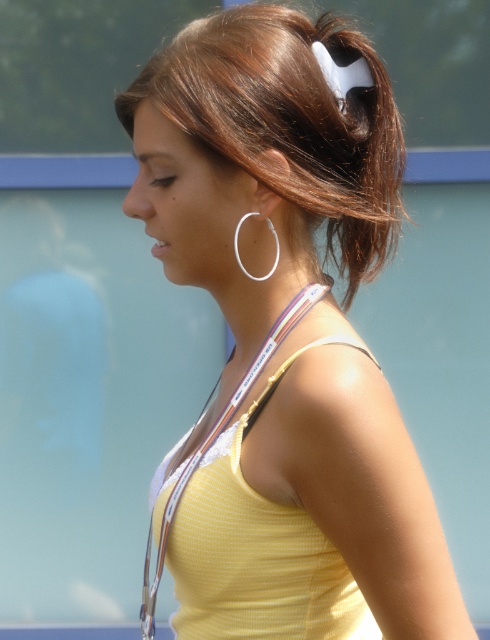
You are taking a photo of the woman and notice two points marked in the image. The first point is at coordinates point (346,182) and the second is at point (273,234). Which point is closer to the camera?

Point (346,182) is further to the camera than point (273,234), so the second point is closer to the camera.

You are a photographer taking a portrait of the woman. You need to ensure that both the brown shiny hair at upper center and the silver metallic hoop at upper center are clearly visible in the frame. Given their sizes, which object should you focus on to ensure both are in focus?

The brown shiny hair at upper center has a larger size compared to the silver metallic hoop at upper center. To ensure both are in focus, you should focus on the brown shiny hair at upper center since it is larger and will require more precise focus to capture details, while the smaller silver metallic hoop at upper center will naturally be within the depth of field.

You are a photographer taking a portrait of the woman. You notice the brown shiny hair at upper center and the silver metallic hoop at upper center. Which object is closer to the camera?

The brown shiny hair at upper center is closer to the camera because it is in front of the silver metallic hoop at upper center.